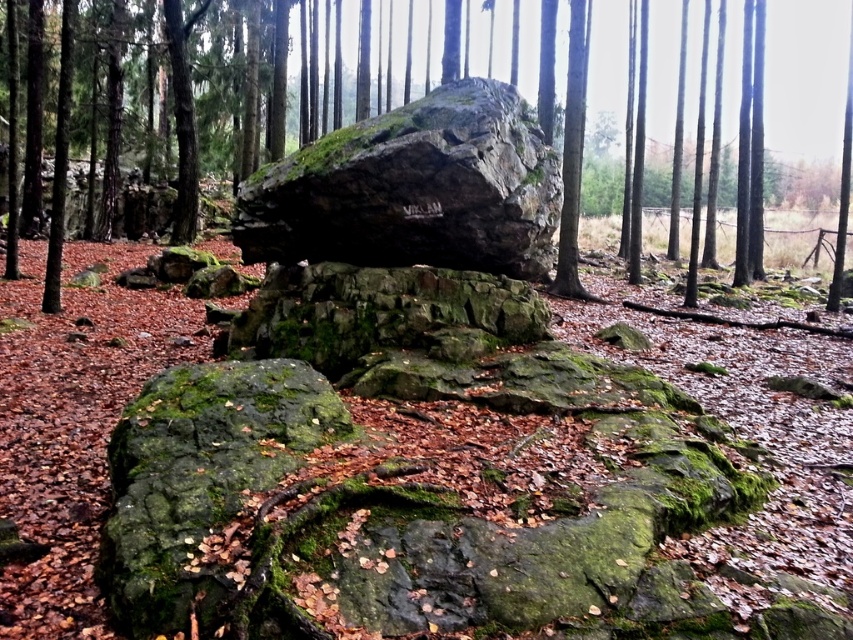
Question: Where is green mossy rock at center located in relation to rough textured rock at center in the image?

Choices:
 (A) above
 (B) below

Answer: (A)

Question: Which of the following is the farthest from the observer?

Choices:
 (A) (467, 148)
 (B) (706, 22)

Answer: (B)

Question: Can you confirm if green mossy rock at center is wider than rough textured rock at center?

Choices:
 (A) no
 (B) yes

Answer: (B)

Question: Can you confirm if green mossy rock at center is bigger than rough textured rock at center?

Choices:
 (A) no
 (B) yes

Answer: (B)

Question: Which point is closer to the camera taking this photo?

Choices:
 (A) (305, 180)
 (B) (302, 202)

Answer: (A)